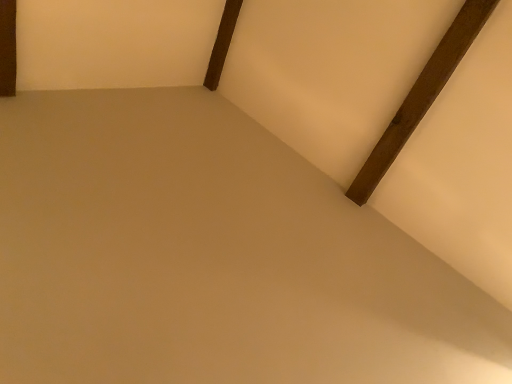
The width and height of the screenshot is (512, 384). Describe the element at coordinates (421, 96) in the screenshot. I see `brown wooden plank at upper right` at that location.

The height and width of the screenshot is (384, 512). Identify the location of brown wooden plank at upper right. (421, 96).

Find the location of a particular element. The width and height of the screenshot is (512, 384). brown wooden plank at upper right is located at coordinates (421, 96).